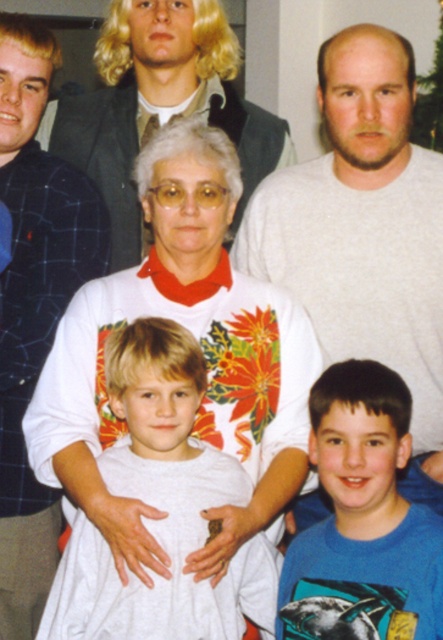
Looking at this image, can you confirm if blue printed t-shirt at lower right is taller than matte gray suit at upper center?

No.

Is point (372, 364) farther from camera compared to point (112, 152)?

No, (372, 364) is closer to viewer.

Locate an element on the screen. The height and width of the screenshot is (640, 443). blue printed t-shirt at lower right is located at coordinates (362, 520).

Is white cotton shirt at center positioned in front of blue plaid shirt at left?

Yes, white cotton shirt at center is closer to the viewer.

The width and height of the screenshot is (443, 640). Find the location of `white cotton shirt at center`. white cotton shirt at center is located at coordinates (162, 508).

Which is behind, point (177, 531) or point (92, 276)?

Point (92, 276)

Where is `white cotton shirt at center`? This screenshot has height=640, width=443. white cotton shirt at center is located at coordinates (162, 508).

Consider the image. Does white cotton shirt at center have a lesser height compared to matte gray suit at upper center?

Yes.

Does white cotton shirt at center appear on the right side of matte gray suit at upper center?

Yes, white cotton shirt at center is to the right of matte gray suit at upper center.

This screenshot has width=443, height=640. Describe the element at coordinates (162, 508) in the screenshot. I see `white cotton shirt at center` at that location.

Locate an element on the screen. white cotton shirt at center is located at coordinates (162, 508).